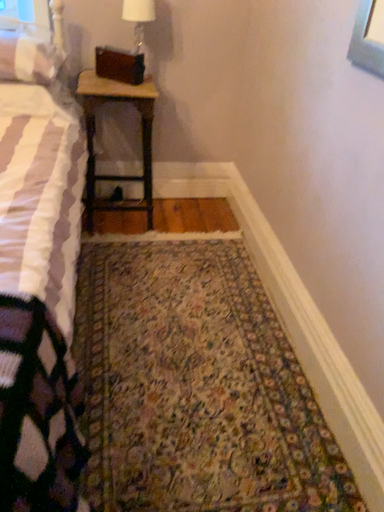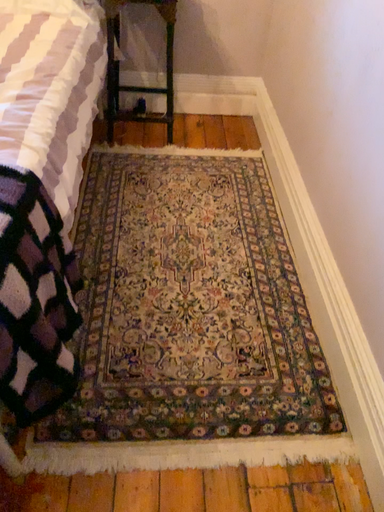
Question: Which way did the camera rotate in the video?

Choices:
 (A) rotated upward
 (B) rotated downward

Answer: (B)